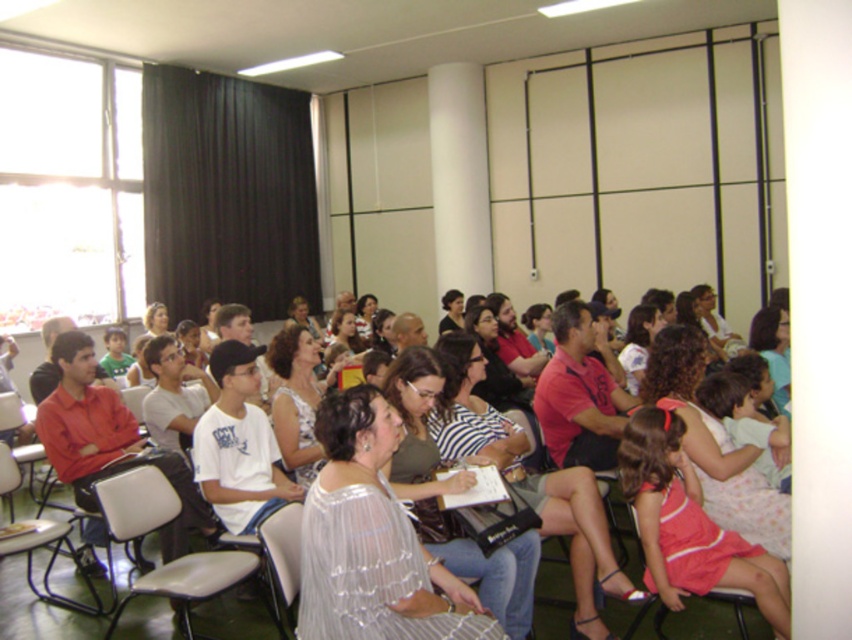
Question: Which object is farther from the camera taking this photo?

Choices:
 (A) gray plastic chair at center
 (B) metallic gray chair at lower left
 (C) matte pink fabric chair at lower right
 (D) metallic gray chair at left

Answer: (D)

Question: Can you confirm if translucent white blouse at center is wider than matte black chair at center?

Choices:
 (A) no
 (B) yes

Answer: (A)

Question: Does black fabric curtain at upper left come behind gray plastic chair at center?

Choices:
 (A) no
 (B) yes

Answer: (B)

Question: Which of these objects is positioned farthest from the translucent white blouse at center?

Choices:
 (A) white plastic chair at center
 (B) matte pink fabric chair at lower right
 (C) matte black chair at center
 (D) black fabric curtain at upper left

Answer: (D)

Question: Which object is positioned closest to the matte pink fabric chair at lower right?

Choices:
 (A) black fabric curtain at upper left
 (B) metallic gray chair at left
 (C) translucent white blouse at center

Answer: (C)

Question: Is translucent white blouse at center wider than matte pink fabric chair at lower right?

Choices:
 (A) yes
 (B) no

Answer: (B)